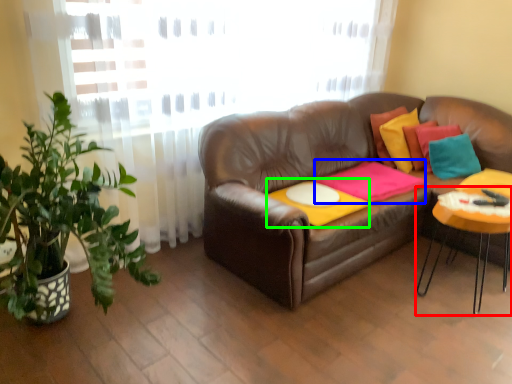
Question: Considering the real-world distances, which object is closest to table (highlighted by a red box)? blanket (highlighted by a blue box) or round table (highlighted by a green box).

Choices:
 (A) blanket
 (B) round table

Answer: (A)